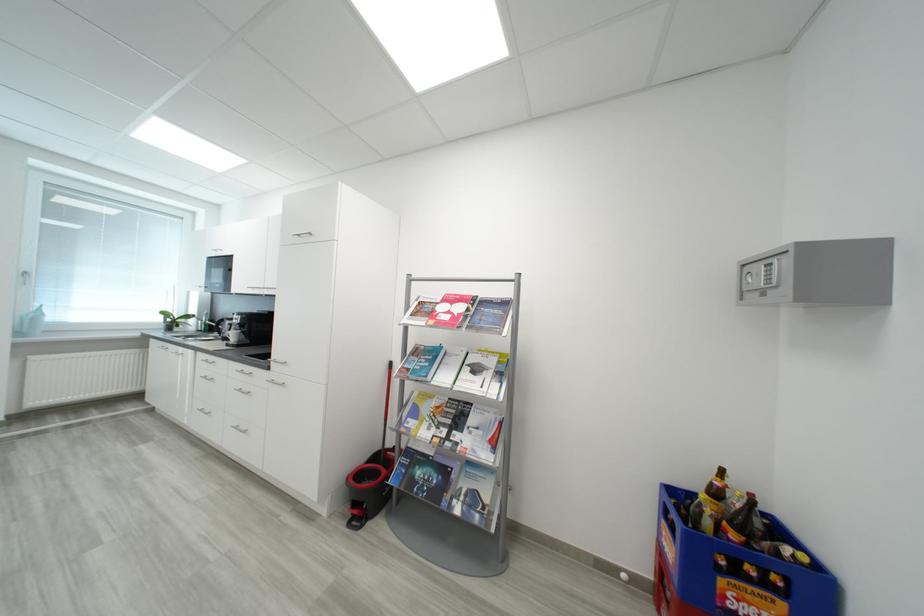
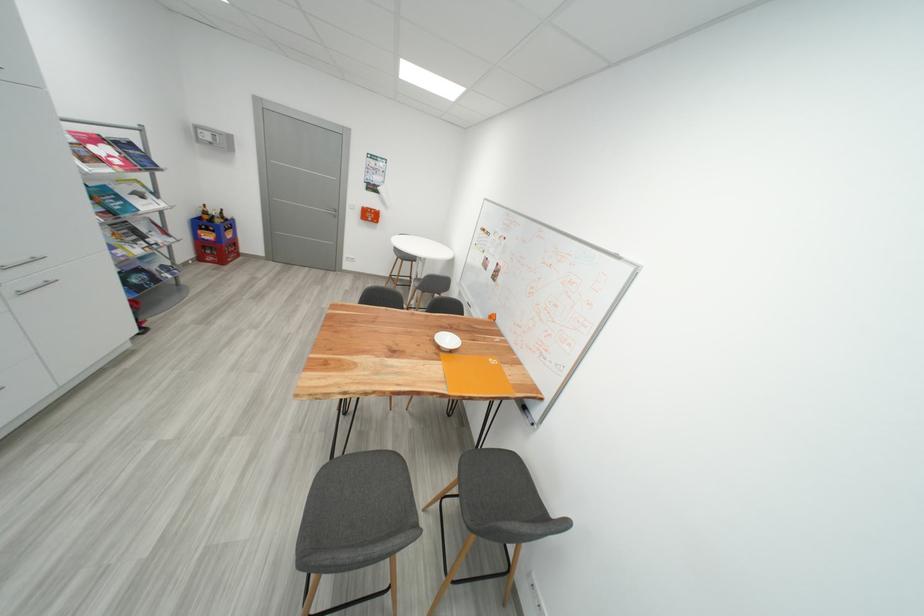
Where in the second image is the point corresponding to [283,382] from the first image?

(30, 291)